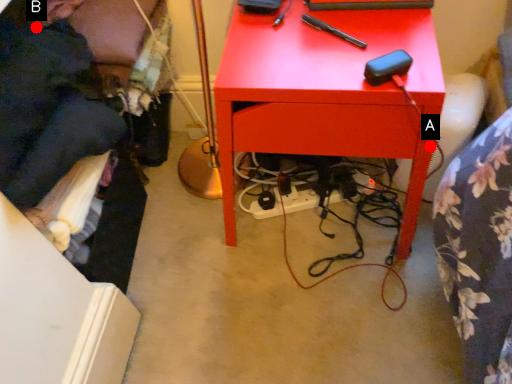
Question: Two points are circled on the image, labeled by A and B beside each circle. Which point is closer to the camera?

Choices:
 (A) A is closer
 (B) B is closer

Answer: (A)